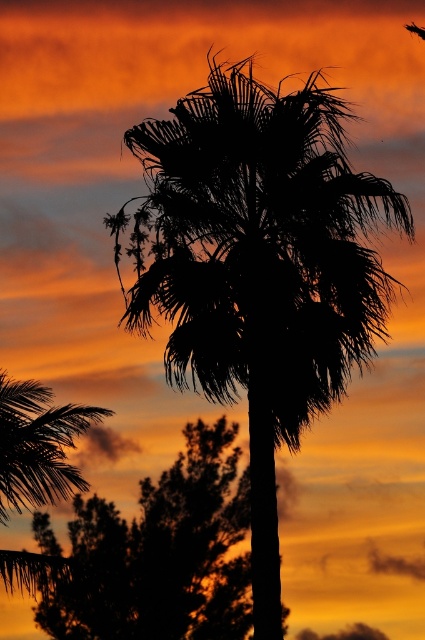
You are standing in front of the scene and want to take a photo of the black silhouette palm tree at center and the silky black palm tree at upper left. Which tree is positioned closer to you?

The black silhouette palm tree at center is closer to the viewer than the silky black palm tree at upper left.

You are an artist sketching the sunset scene. You want to draw the silhouette leafy tree at center and the silky black palm tree at upper left. Which tree should you draw first if you want to follow the correct layering order based on their positions?

You should draw the silky black palm tree at upper left first because the silhouette leafy tree at center is positioned under it, meaning it should be layered on top in your sketch.